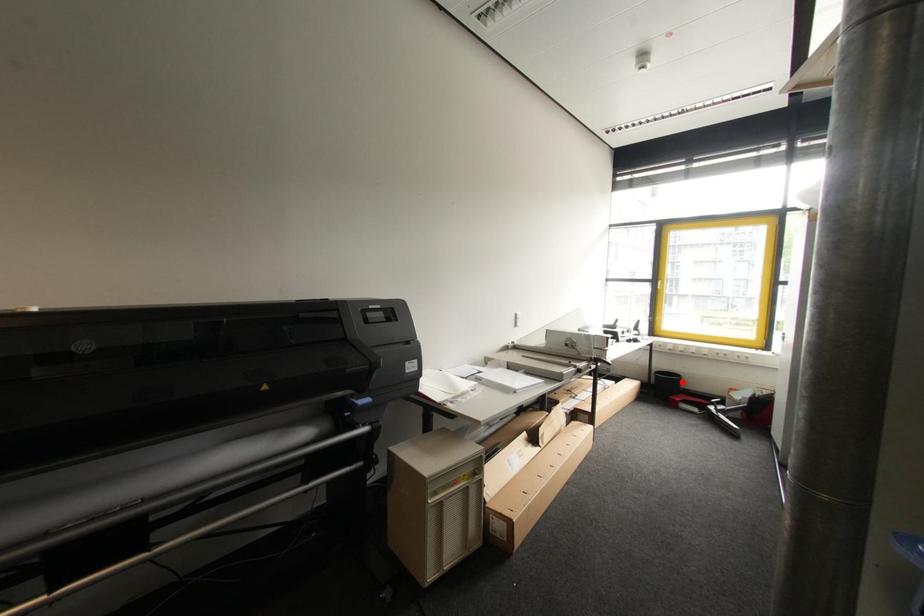
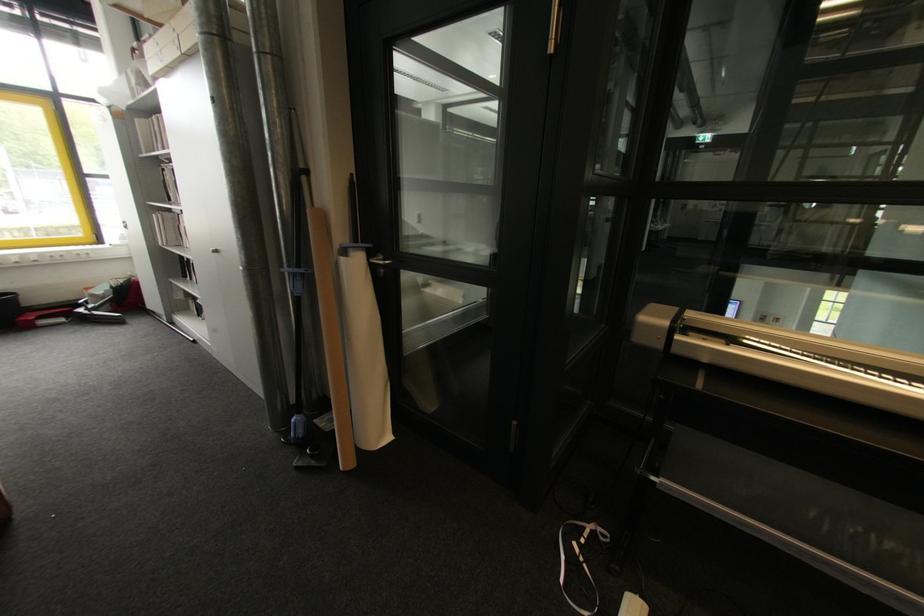
Find the pixel in the second image that matches the highlighted location in the first image.

(19, 301)